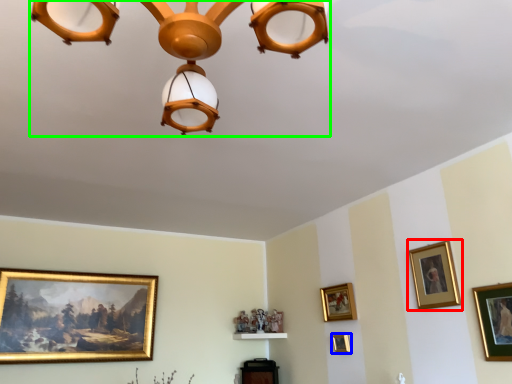
Question: Which object is positioned closest to picture frame (highlighted by a red box)? Select from picture frame (highlighted by a blue box) and lamp (highlighted by a green box).

Choices:
 (A) picture frame
 (B) lamp

Answer: (A)